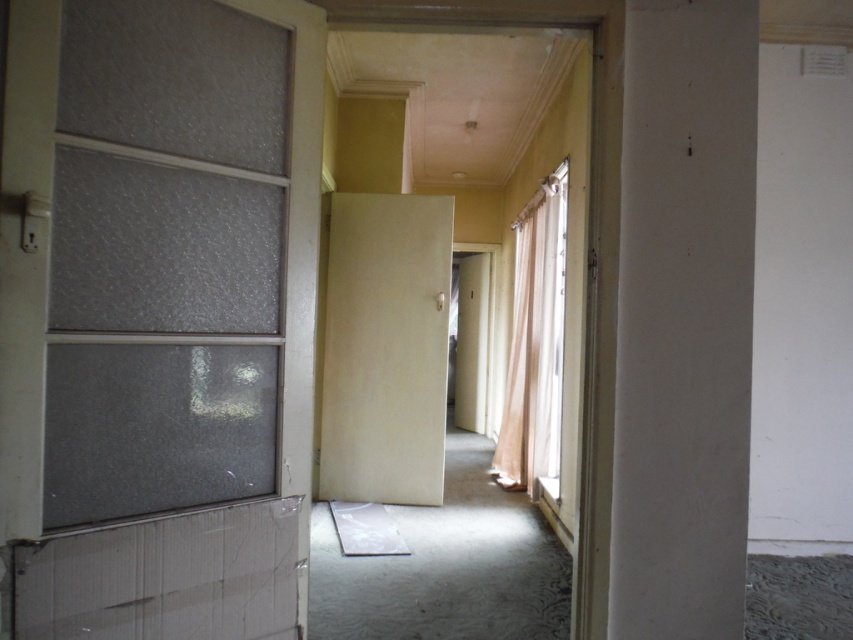
You are moving a 12 feet long ladder through a corridor and need to pass between the matte beige door at center and the transparent plastic screen door at center. Can the ladder fit through the space between them?

The distance between the matte beige door at center and the transparent plastic screen door at center is 12.11 feet. Since the ladder is 12 feet long, it can fit through the space as there is enough clearance.

You are standing in the middle of the corridor and see the point marked at coordinates (386, 348). What object is located at that point?

The point at coordinates (386, 348) corresponds to the matte beige door at center.